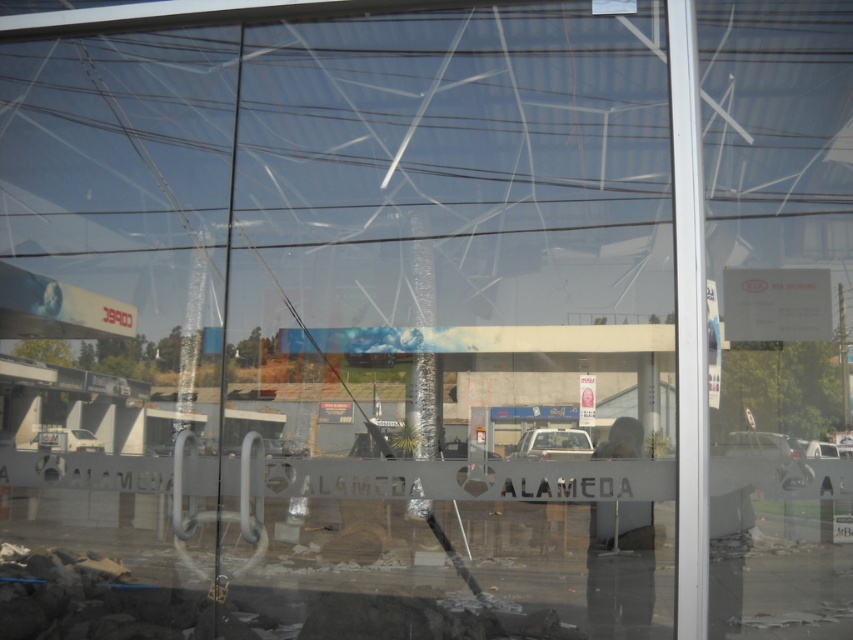
Question: Considering the relative positions of metallic silver car at lower right and white glossy car at lower left in the image provided, where is metallic silver car at lower right located with respect to white glossy car at lower left?

Choices:
 (A) right
 (B) left

Answer: (A)

Question: Estimate the real-world distances between objects in this image. Which object is farther from the white glossy car at lower left?

Choices:
 (A) metallic silver car at lower right
 (B) white matte car at center
 (C) white glossy car at center

Answer: (A)

Question: Does white matte car at center appear on the right side of white glossy car at lower left?

Choices:
 (A) yes
 (B) no

Answer: (A)

Question: Does white glossy car at lower left appear under white glossy car at center?

Choices:
 (A) yes
 (B) no

Answer: (A)

Question: Which of the following is the farthest from the observer?

Choices:
 (A) white glossy car at lower left
 (B) white glossy car at center
 (C) metallic silver car at lower right

Answer: (B)

Question: Which of the following is the closest to the observer?

Choices:
 (A) (827, 445)
 (B) (728, 444)
 (C) (514, 448)
 (D) (67, 448)

Answer: (B)